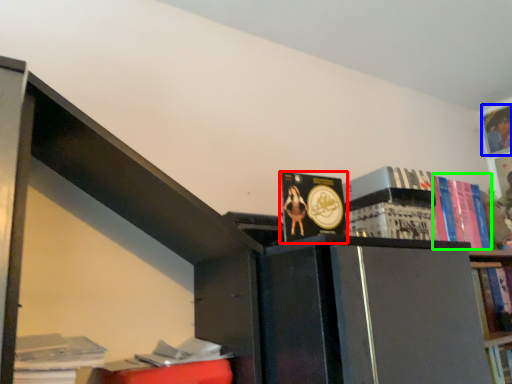
Question: Estimate the real-world distances between objects in this image. Which object is farther from book (highlighted by a red box), book (highlighted by a blue box) or book (highlighted by a green box)?

Choices:
 (A) book
 (B) book

Answer: (A)